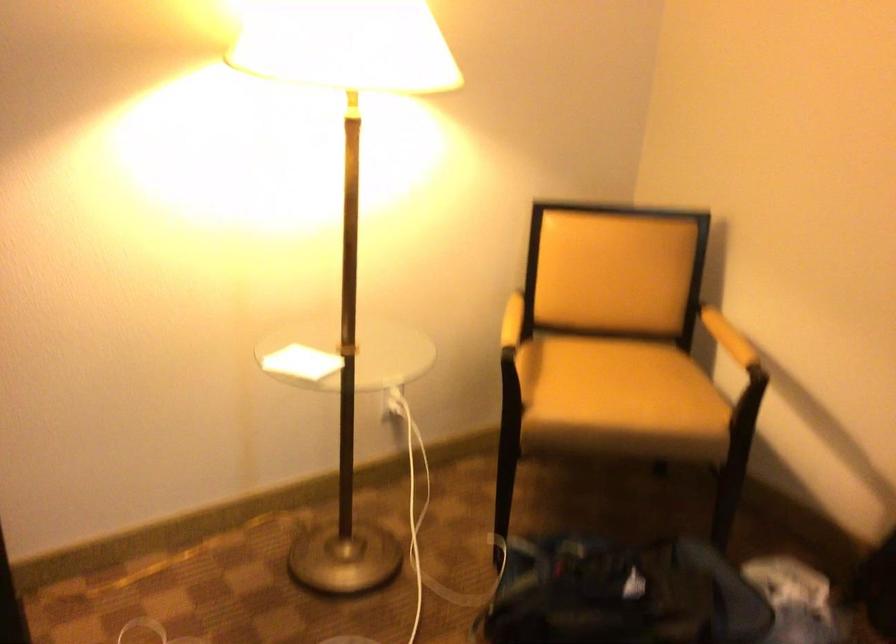
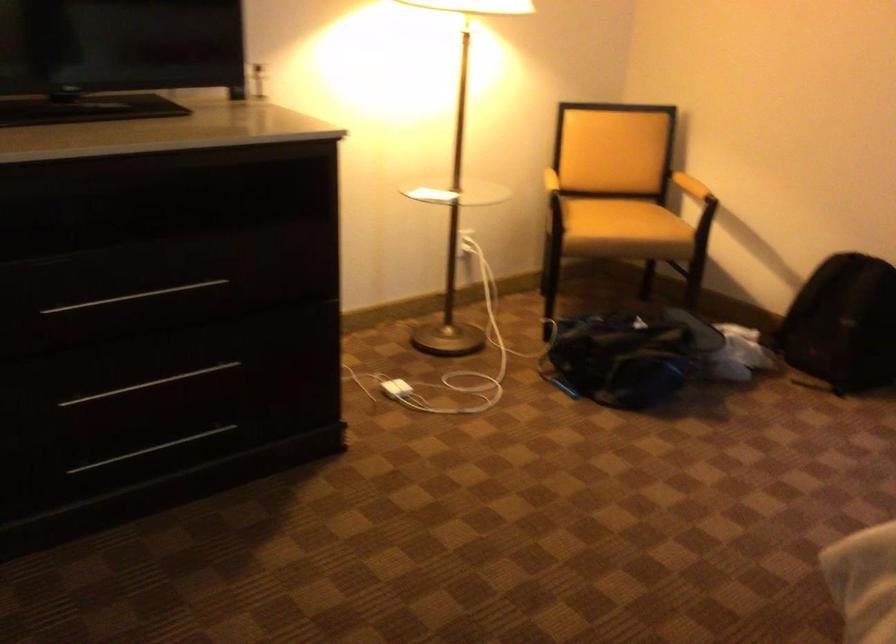
Locate, in the second image, the point that corresponds to point (625, 401) in the first image.

(623, 220)